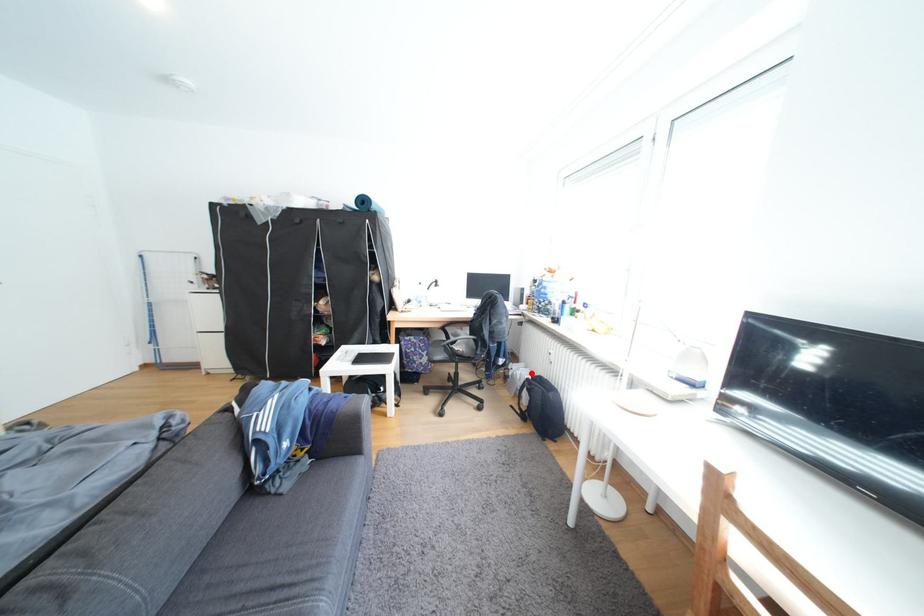
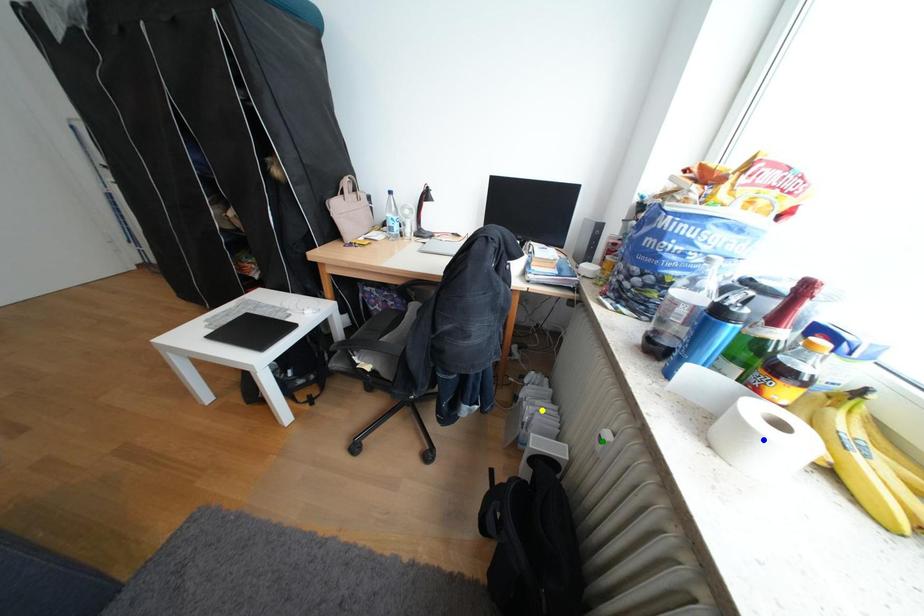
Question: I am providing you with two images of the same scene from different viewpoints. A red point is marked on the first image. You are given multiple points on the second image. Which point in image 2 is actually the same real-world point as the red point in image 1?

Choices:
 (A) blue point
 (B) green point
 (C) yellow point

Answer: (C)